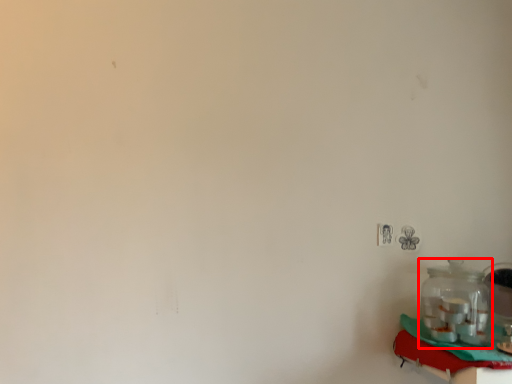
Question: Observing the image, what is the correct spatial positioning of bottle (annotated by the red box) in reference to table?

Choices:
 (A) right
 (B) left

Answer: (B)